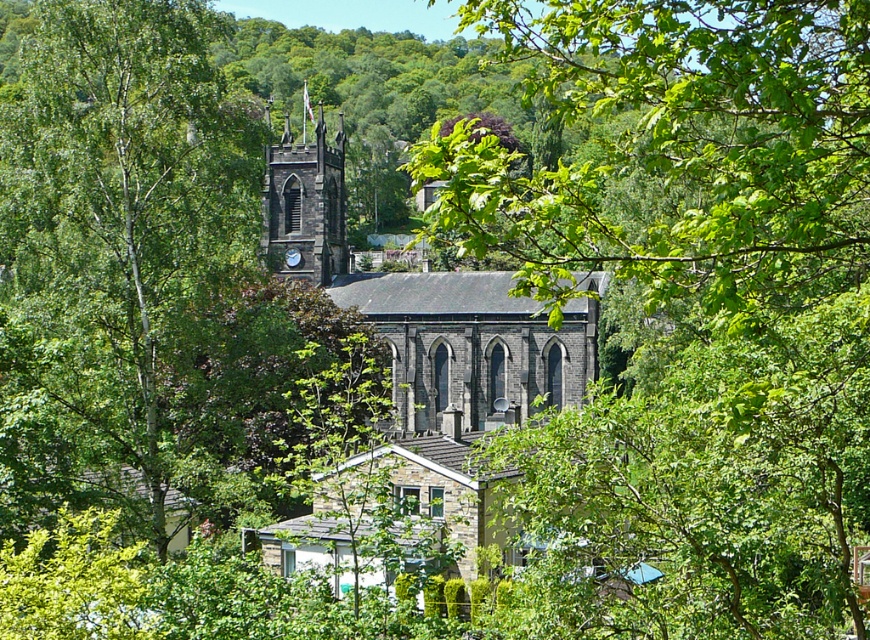
Based on the photo, does green leafy tree at center have a greater width compared to dark gray stone clock tower at center?

Correct, the width of green leafy tree at center exceeds that of dark gray stone clock tower at center.

Can you confirm if green leafy tree at center is bigger than dark gray stone clock tower at center?

Indeed, green leafy tree at center has a larger size compared to dark gray stone clock tower at center.

Does point (139, 61) come farther from viewer compared to point (298, 275)?

No, (139, 61) is in front of (298, 275).

Find the location of a particular element. green leafy tree at center is located at coordinates pos(119,252).